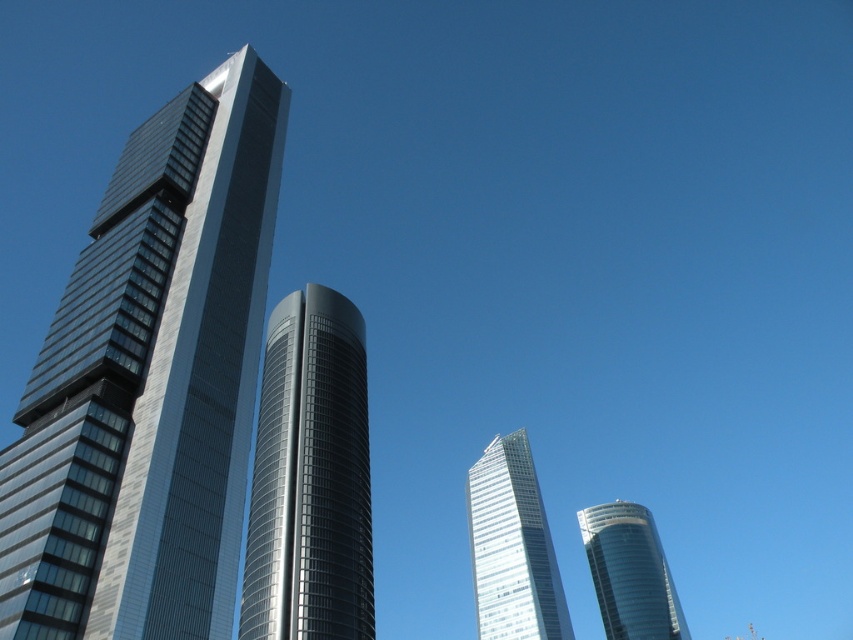
You are an architect evaluating the structural integrity of the buildings in the image. Given that the shiny glass skyscraper at left has a narrower base, would its current width be sufficient to support its height compared to the glossy glass tower at center?

The shiny glass skyscraper at left is thinner than the glossy glass tower at center, so its narrower base may not be sufficient to support its height compared to the glossy glass tower at center.

You are a drone operator tasked with flying a drone from the transparent glass skyscraper at center to the shiny glass tower at lower right. Based on their positions, will the drone need to ascend or descend to reach its destination?

The transparent glass skyscraper at center is located above the shiny glass tower at lower right, so the drone will need to descend to reach the shiny glass tower at lower right.